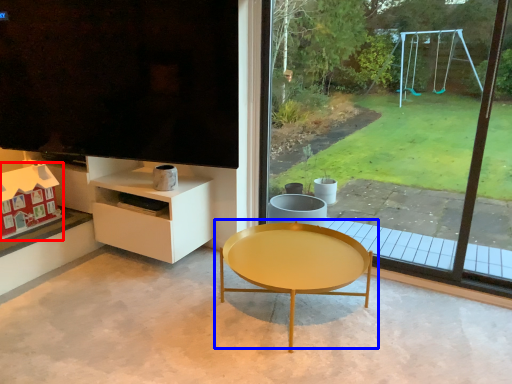
Question: Among these objects, which one is farthest to the camera, toy (highlighted by a red box) or coffee table (highlighted by a blue box)?

Choices:
 (A) toy
 (B) coffee table

Answer: (A)